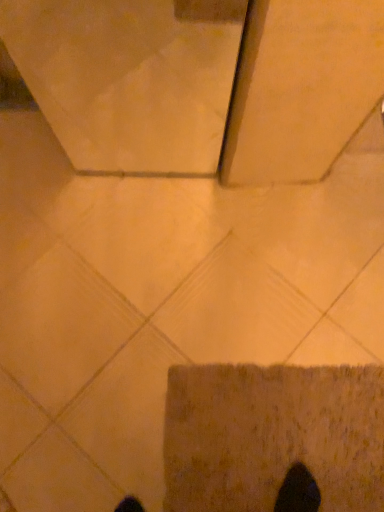
This screenshot has width=384, height=512. Describe the element at coordinates (272, 436) in the screenshot. I see `brown textured bath mat at lower center` at that location.

In order to face brown textured bath mat at lower center, should I rotate leftwards or rightwards?

To align with it, rotate right about 11.137°.

Find the location of a particular element. The image size is (384, 512). brown textured bath mat at lower center is located at coordinates (272, 436).

Locate an element on the screen. The width and height of the screenshot is (384, 512). brown textured bath mat at lower center is located at coordinates (272, 436).